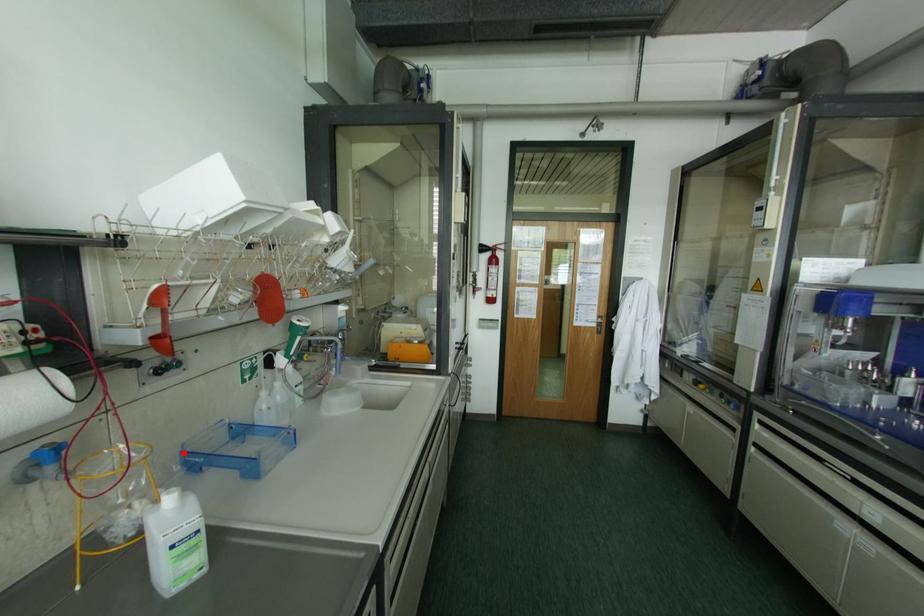
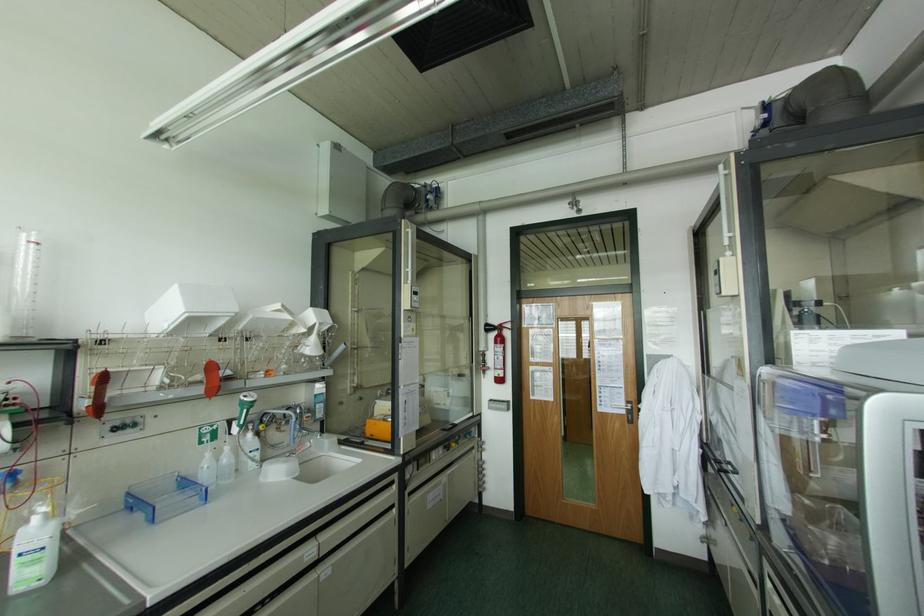
Where in the second image is the point corresponding to the highlighted location from the first image?

(128, 493)